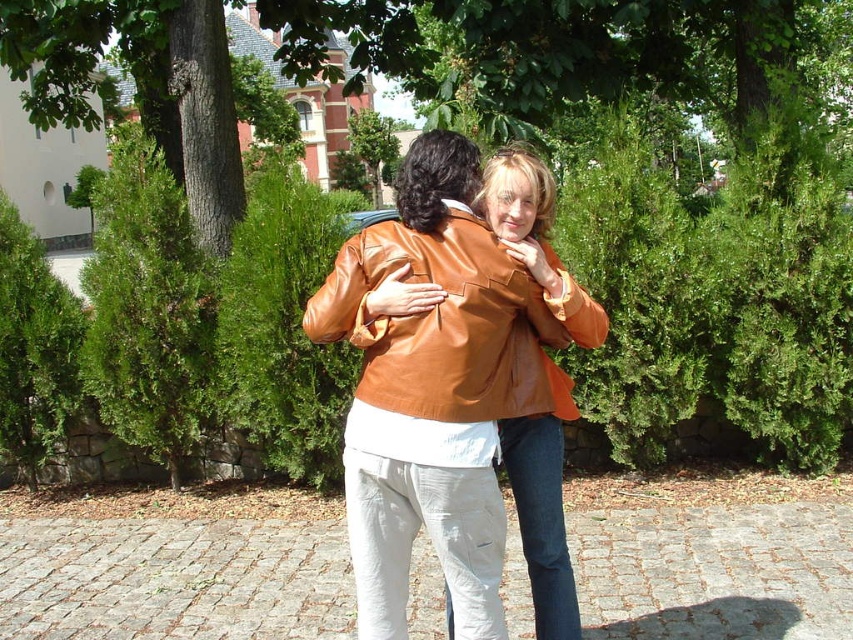
Is matte brown leather jacket at center wider than orange leather jacket at center?

Indeed, matte brown leather jacket at center has a greater width compared to orange leather jacket at center.

Who is more forward, (407, 163) or (519, 492)?

Point (407, 163) is more forward.

Identify the location of matte brown leather jacket at center. This screenshot has width=853, height=640. (437, 381).

Does matte brown leather jacket at center have a lesser width compared to shiny orange jacket at center?

Yes, matte brown leather jacket at center is thinner than shiny orange jacket at center.

You are a GUI agent. You are given a task and a screenshot of the screen. Output one action in this format:
    pyautogui.click(x=<x>, y=<y>)
    Task: Click on the matte brown leather jacket at center
    The height and width of the screenshot is (640, 853).
    Given the screenshot: What is the action you would take?
    pyautogui.click(x=437, y=381)

Measure the distance between shiny orange jacket at center and orange leather jacket at center.

9.99 inches

From the picture: Is shiny orange jacket at center above orange leather jacket at center?

Correct, shiny orange jacket at center is located above orange leather jacket at center.

I want to click on shiny orange jacket at center, so coord(454,324).